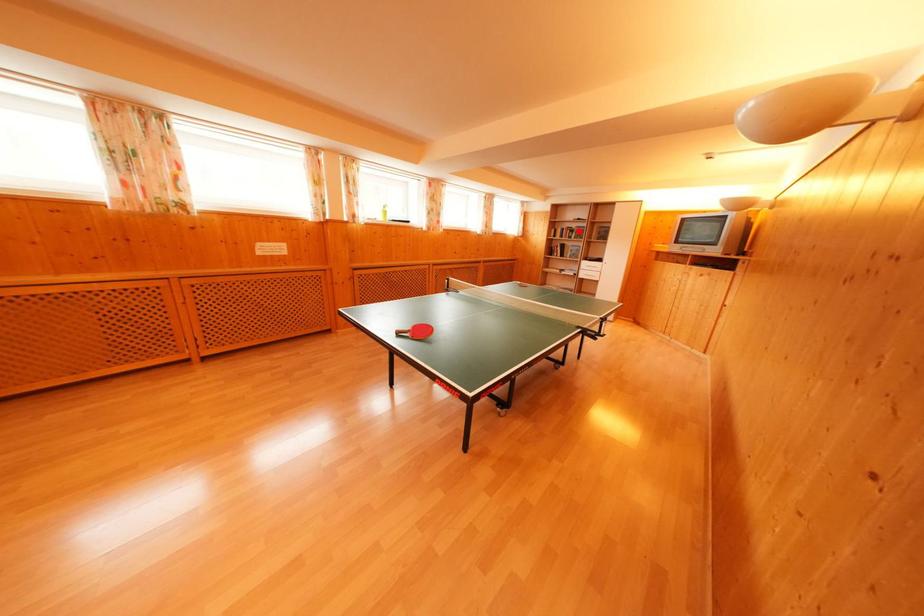
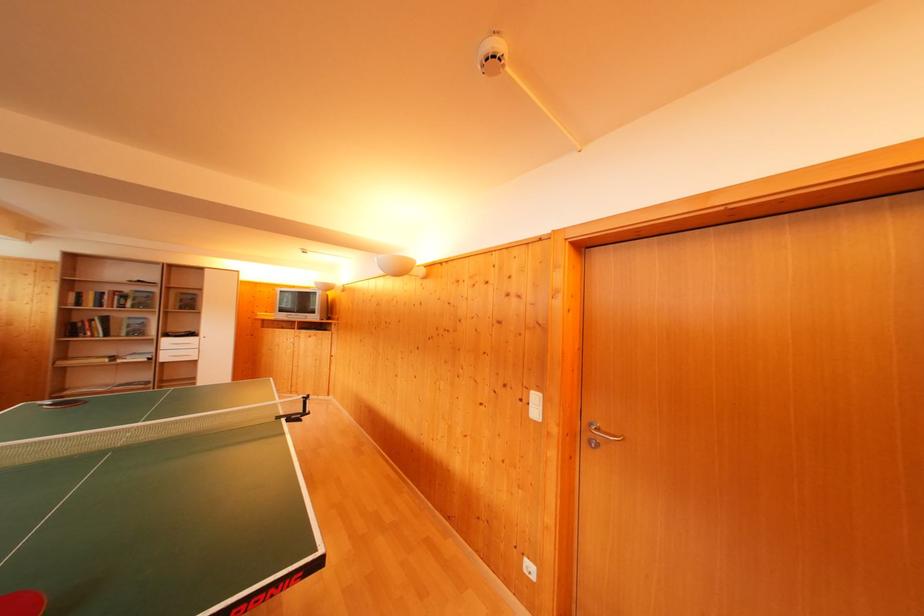
Find the pixel in the second image that matches the highlighted location in the first image.

(131, 294)